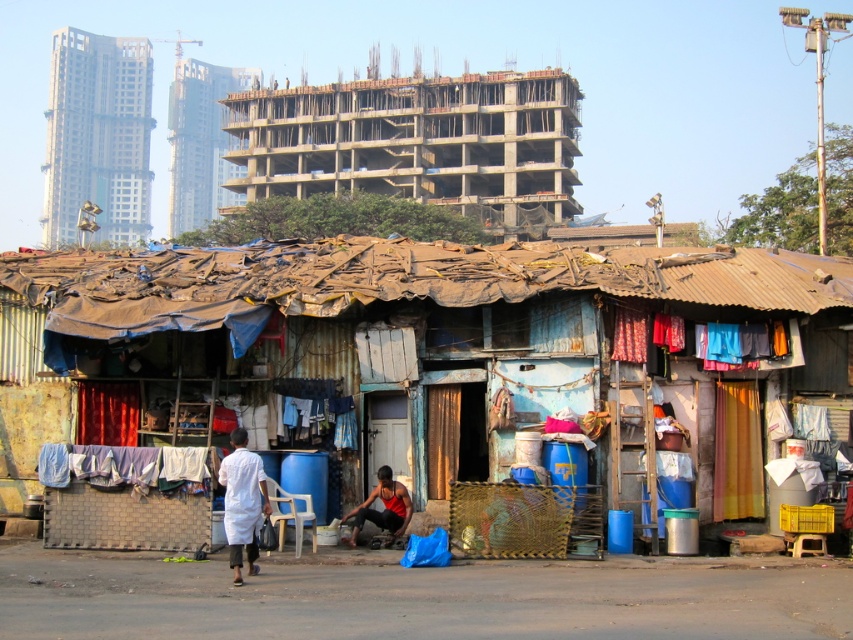
Who is higher up, concrete building at upper center or white cloth at center?

concrete building at upper center

Can you confirm if concrete building at upper center is taller than white cloth at center?

Yes.

This screenshot has width=853, height=640. I want to click on concrete building at upper center, so pyautogui.click(x=419, y=144).

Consider the image. Between rusty corrugated hut at center and red fabric shirt at lower center, which one is positioned lower?

Positioned lower is red fabric shirt at lower center.

Does rusty corrugated hut at center appear over red fabric shirt at lower center?

Yes.

Between point (584, 408) and point (386, 525), which one is positioned behind?

The point (584, 408) is more distant.

Locate an element on the screen. rusty corrugated hut at center is located at coordinates (456, 348).

Is point (47, 445) positioned after point (224, 502)?

Yes, it is behind point (224, 502).

Is white fabric at lower left bigger than white cloth at center?

Correct, white fabric at lower left is larger in size than white cloth at center.

The image size is (853, 640). In order to click on white fabric at lower left in this screenshot , I will do (x=122, y=465).